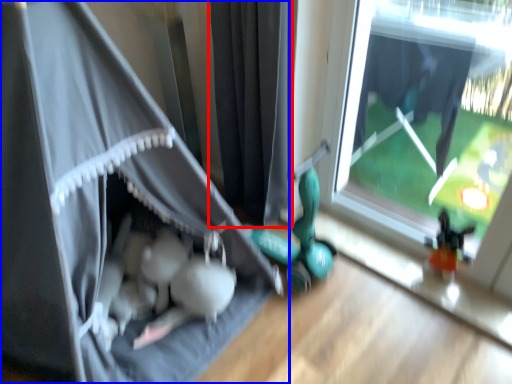
Question: Which object appears farthest to the camera in this image, curtain (highlighted by a red box) or curtain (highlighted by a blue box)?

Choices:
 (A) curtain
 (B) curtain

Answer: (A)